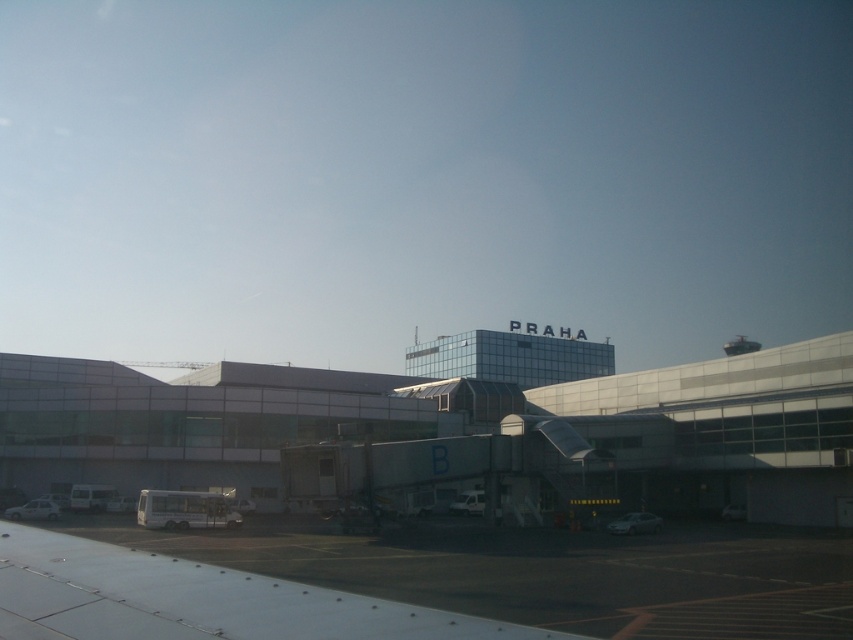
Does glassy metallic airport terminal at center appear on the left side of white metallic wing at lower left?

Correct, you'll find glassy metallic airport terminal at center to the left of white metallic wing at lower left.

Between point (793, 355) and point (163, 598), which one is positioned in front?

Point (163, 598)

Locate an element on the screen. glassy metallic airport terminal at center is located at coordinates tap(450, 433).